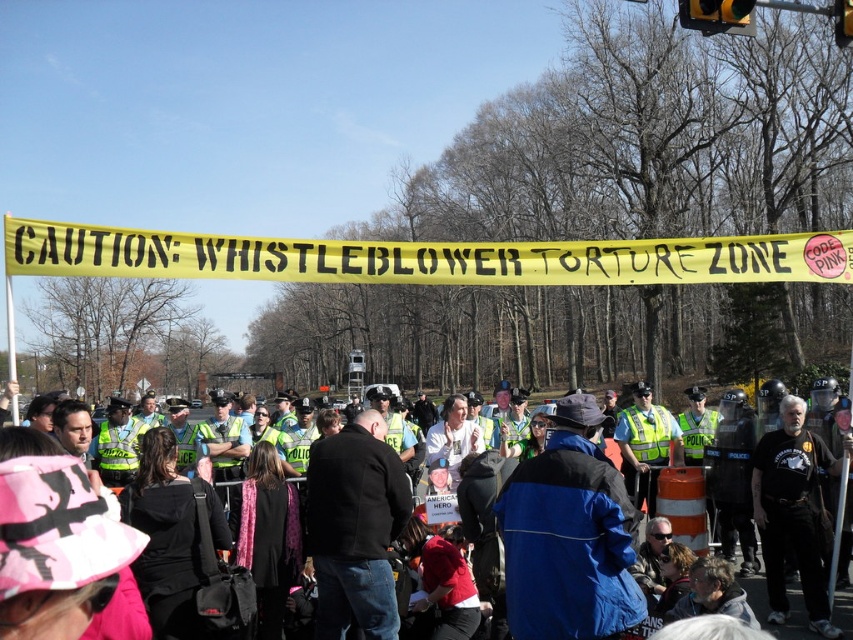
Question: Can you confirm if blue fabric jacket at center is thinner than blue denim jacket at center?

Choices:
 (A) no
 (B) yes

Answer: (A)

Question: Does yellow caution tape at center have a greater width compared to blue fabric jacket at center?

Choices:
 (A) no
 (B) yes

Answer: (B)

Question: Which object is farther from the camera taking this photo?

Choices:
 (A) blue denim jacket at center
 (B) blue fabric jacket at center
 (C) yellow caution tape at center

Answer: (A)

Question: Which object appears farthest from the camera in this image?

Choices:
 (A) yellow caution tape at center
 (B) blue fabric jacket at center
 (C) blue denim jacket at center

Answer: (C)

Question: Which point appears closest to the camera in this image?

Choices:
 (A) (576, 481)
 (B) (357, 273)

Answer: (A)

Question: In this image, where is yellow caution tape at center located relative to blue fabric jacket at center?

Choices:
 (A) above
 (B) below

Answer: (A)